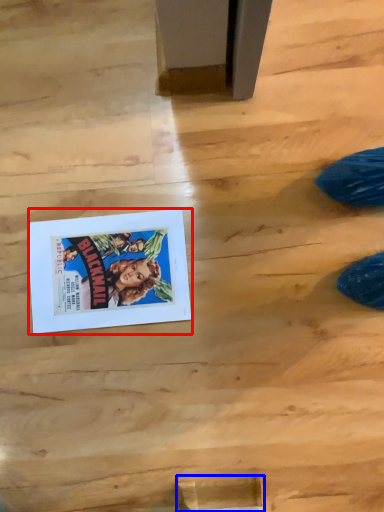
Question: Which object appears closest to the camera in this image, comic book (highlighted by a red box) or wood (highlighted by a blue box)?

Choices:
 (A) comic book
 (B) wood

Answer: (B)